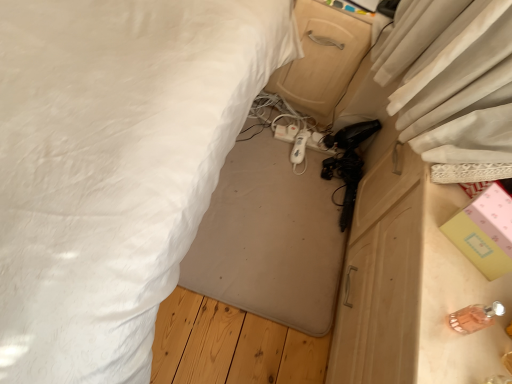
The width and height of the screenshot is (512, 384). In order to click on vacant area that lies to the right of white matte remote control at center, placed as the first equipment when sorted from back to front in this screenshot , I will do `click(325, 166)`.